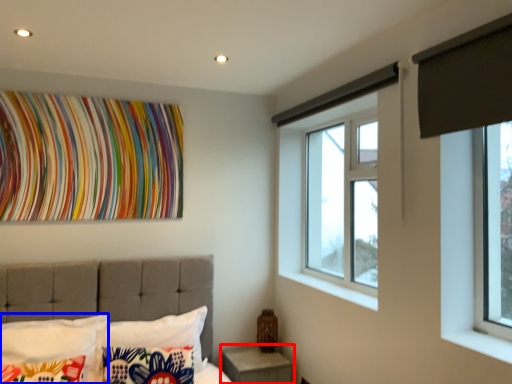
Question: Which object appears farthest to the camera in this image, nightstand (highlighted by a red box) or pillow (highlighted by a blue box)?

Choices:
 (A) nightstand
 (B) pillow

Answer: (A)